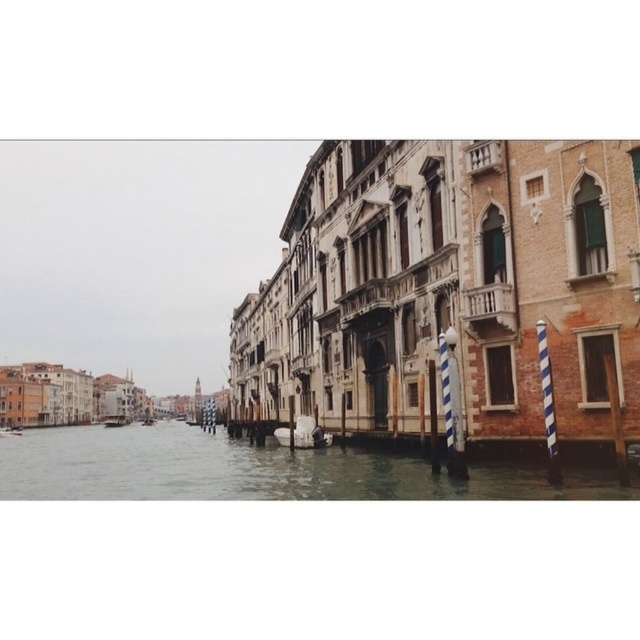
Looking at this image, you are standing on a bridge overlooking the canal and want to take a photo of both the clear water at center and the white glossy boat at center. Which object will appear larger in your photo?

The clear water at center will appear larger in the photo because it is closer to the viewer than the white glossy boat at center.

You are a tourist standing on the bridge above the canal. You see the clear water at center and the wooden boat at center. Which object is directly below the other?

The clear water at center is positioned over the wooden boat at center, so the wooden boat at center is directly below the clear water at center.

You are a tourist standing on the right side of the canal, looking towards the left. You see a white glossy boat at center and a wooden boat at center. Which boat is closer to the buildings on the right side of the canal?

The wooden boat at center is closer to the buildings on the right side of the canal because the white glossy boat at center is positioned to its right, placing the wooden boat nearer to the right side buildings.